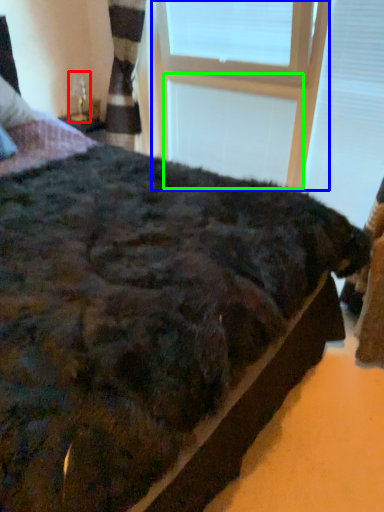
Question: Which object is the closest to the table lamp (highlighted by a red box)? Choose among these: window frame (highlighted by a blue box) or window frame (highlighted by a green box).

Choices:
 (A) window frame
 (B) window frame

Answer: (A)